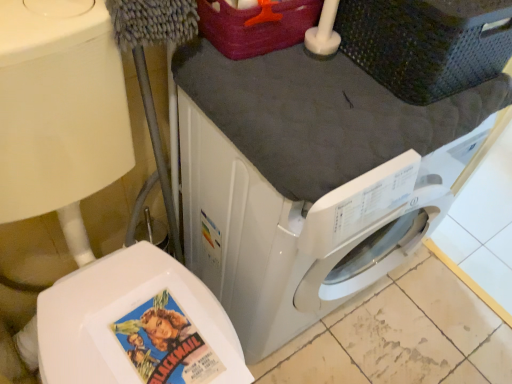
Question: Could you tell me if matte paper comic book at lower left is turned towards dark gray plastic basket at upper right?

Choices:
 (A) no
 (B) yes

Answer: (A)

Question: Can dark gray plastic basket at upper right be found inside matte paper comic book at lower left?

Choices:
 (A) no
 (B) yes

Answer: (A)

Question: Is matte paper comic book at lower left wider than dark gray plastic basket at upper right?

Choices:
 (A) no
 (B) yes

Answer: (A)

Question: From a real-world perspective, is matte paper comic book at lower left beneath dark gray plastic basket at upper right?

Choices:
 (A) yes
 (B) no

Answer: (A)

Question: Does matte paper comic book at lower left lie in front of dark gray plastic basket at upper right?

Choices:
 (A) no
 (B) yes

Answer: (A)

Question: Is point (154, 322) closer or farther from the camera than point (420, 66)?

Choices:
 (A) farther
 (B) closer

Answer: (A)

Question: From their relative heights in the image, would you say matte paper comic book at lower left is taller or shorter than dark gray plastic basket at upper right?

Choices:
 (A) tall
 (B) short

Answer: (B)

Question: In the image, is matte paper comic book at lower left positioned in front of or behind dark gray plastic basket at upper right?

Choices:
 (A) front
 (B) behind

Answer: (B)

Question: From a real-world perspective, is matte paper comic book at lower left above or below dark gray plastic basket at upper right?

Choices:
 (A) above
 (B) below

Answer: (B)

Question: From a real-world perspective, is dark gray plastic basket at upper right physically located above or below white glossy washing machine at center?

Choices:
 (A) below
 (B) above

Answer: (B)

Question: Considering the positions of point (401, 19) and point (249, 253), is point (401, 19) closer or farther from the camera than point (249, 253)?

Choices:
 (A) closer
 (B) farther

Answer: (A)

Question: Relative to white glossy washing machine at center, is dark gray plastic basket at upper right in front or behind?

Choices:
 (A) behind
 (B) front

Answer: (A)

Question: From the image's perspective, is dark gray plastic basket at upper right positioned above or below white glossy washing machine at center?

Choices:
 (A) below
 (B) above

Answer: (B)

Question: Does point (264, 185) appear closer or farther from the camera than point (198, 339)?

Choices:
 (A) closer
 (B) farther

Answer: (A)

Question: From their relative heights in the image, would you say white glossy washing machine at center is taller or shorter than matte paper comic book at lower left?

Choices:
 (A) short
 (B) tall

Answer: (B)